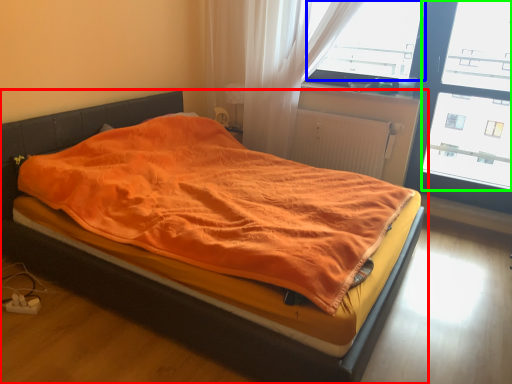
Question: Which object is the farthest from bed (highlighted by a red box)? Choose among these: window screen (highlighted by a blue box) or window screen (highlighted by a green box).

Choices:
 (A) window screen
 (B) window screen

Answer: (B)